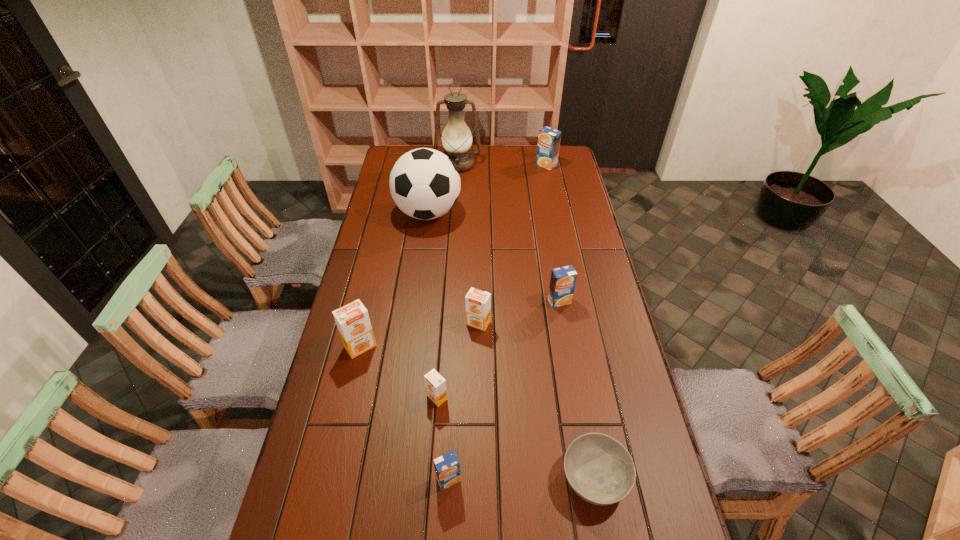
Locate an element on the screen. vacant space that's between the second nearest orange juice and the rightmost orange orange juice is located at coordinates (458, 360).

This screenshot has height=540, width=960. In order to click on free space between the third nearest object and the third orange juice from right to left in this screenshot , I will do `click(458, 360)`.

Locate an element on the screen. Image resolution: width=960 pixels, height=540 pixels. vacant region between the bowl and the second tallest object is located at coordinates (512, 345).

I want to click on vacant space in between the biggest orange orange juice and the bowl, so 477,411.

Find the location of a particular element. free area in between the fourth farthest orange juice and the nearest blue orange_juice is located at coordinates (404, 413).

Identify which object is the fifth nearest to the bowl. Please provide its 2D coordinates. Your answer should be formatted as a tuple, i.e. [(x, y)], where the tuple contains the x and y coordinates of a point satisfying the conditions above.

[(352, 320)]

Image resolution: width=960 pixels, height=540 pixels. Identify the location of object that can be found as the fourth closest to the second tallest object. [563, 279].

Locate which orange juice ranks in proximity to the bowl. Please provide its 2D coordinates. Your answer should be formatted as a tuple, i.e. [(x, y)], where the tuple contains the x and y coordinates of a point satisfying the conditions above.

[(447, 467)]

In order to click on orange juice that stands as the sixth closest to the shortest object in this screenshot , I will do `click(549, 139)`.

Identify the location of the second closest blue orange_juice relative to the nearest blue orange_juice. (549, 139).